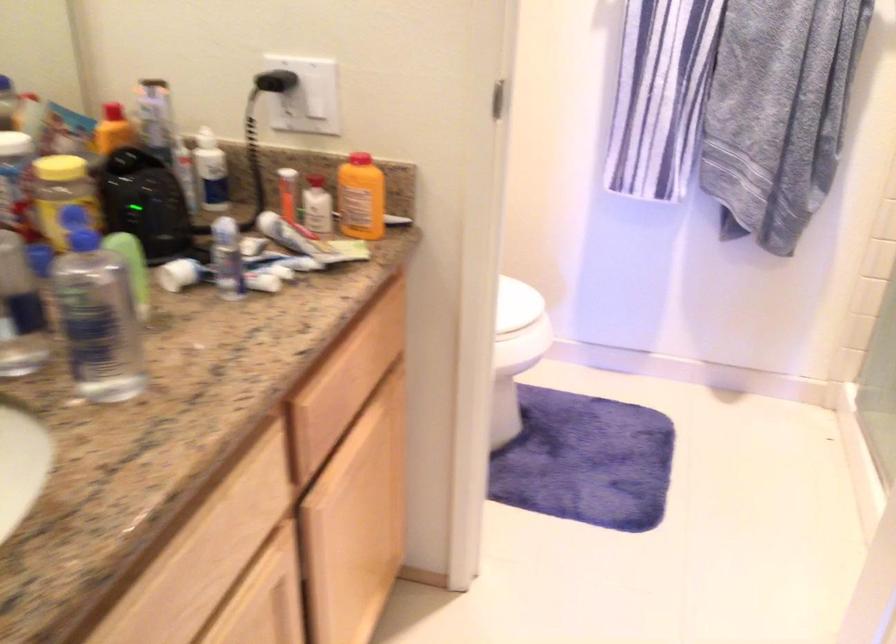
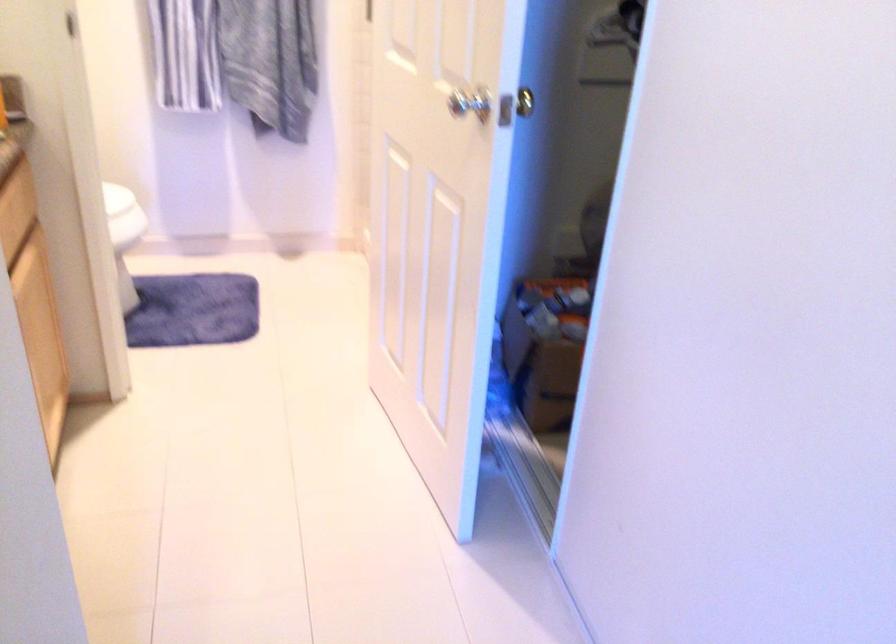
In the second image, find the point that corresponds to pixel 319 406 in the first image.

(12, 229)